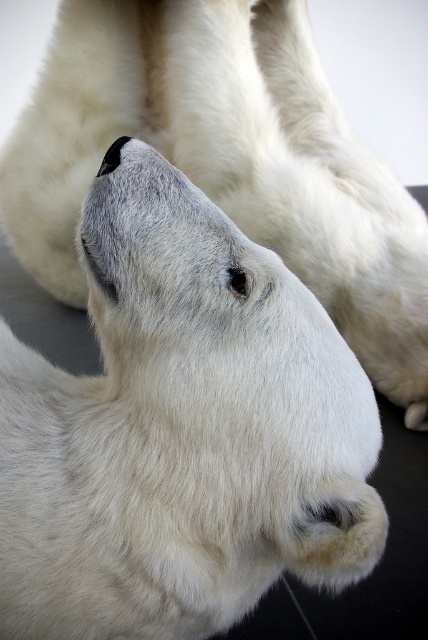
You are a wildlife photographer aiming to capture the polar bear in the center. Based on the coordinates provided, where should you position your camera relative to the white fur polar bear at center to ensure it fills the frame?

The white fur polar bear at center is located at point (181,429), so you should position your camera slightly to the right and above the bear to center it in the frame.

You are a wildlife photographer aiming to capture the texture of the white fur polar bear at center and the white fur at center. Which area should you focus on to highlight the thicker fur?

The white fur at center has thicker fur compared to the white fur polar bear at center, so focusing on the white fur at center would better highlight the thicker texture.

You are a photographer taking a picture of a polar bear. You notice two points on the bear, one at point (x=59, y=420) and another at point (x=371, y=346). Which point is closer to your camera lens?

Point (x=59, y=420) is closer to the viewer than point (x=371, y=346).